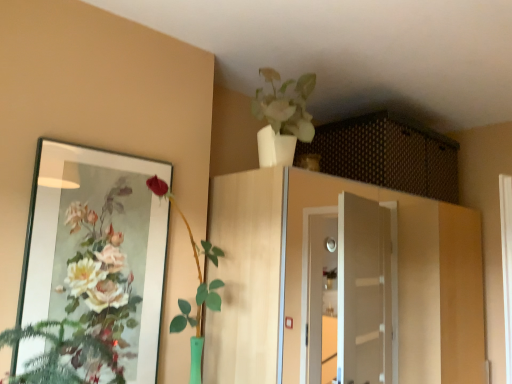
Question: From a real-world perspective, relative to green glass vase at left, the first houseplant from the bottom, is wooden cabinet at center, positioned as the 1th cabinetry in bottom-to-top order, vertically above or below?

Choices:
 (A) above
 (B) below

Answer: (B)

Question: Does point (243, 377) appear closer or farther from the camera than point (200, 271)?

Choices:
 (A) closer
 (B) farther

Answer: (A)

Question: Considering the real-world distances, which object is closest to the green glass vase at left, which is counted as the second houseplant, starting from the right?

Choices:
 (A) wooden cabinet at center, acting as the 2th cabinetry starting from the top
 (B) matte glass mirror at left
 (C) brown woven basket at upper center, the 2th cabinetry in the bottom-to-top sequence
 (D) white glossy vase at upper center, which is the 1th houseplant in top-to-bottom order

Answer: (B)

Question: Which object is positioned farthest from the wooden cabinet at center, acting as the 2th cabinetry starting from the top?

Choices:
 (A) white glossy vase at upper center, which is the 1th houseplant in top-to-bottom order
 (B) green glass vase at left, which is counted as the second houseplant, starting from the right
 (C) matte glass mirror at left
 (D) brown woven basket at upper center, the 2th cabinetry in the bottom-to-top sequence

Answer: (C)